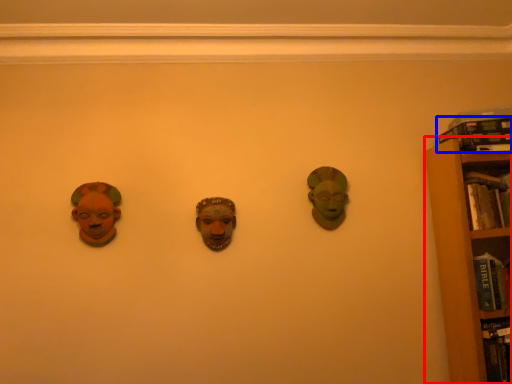
Question: Among these objects, which one is nearest to the camera, bookcase (highlighted by a red box) or book (highlighted by a blue box)?

Choices:
 (A) bookcase
 (B) book

Answer: (A)